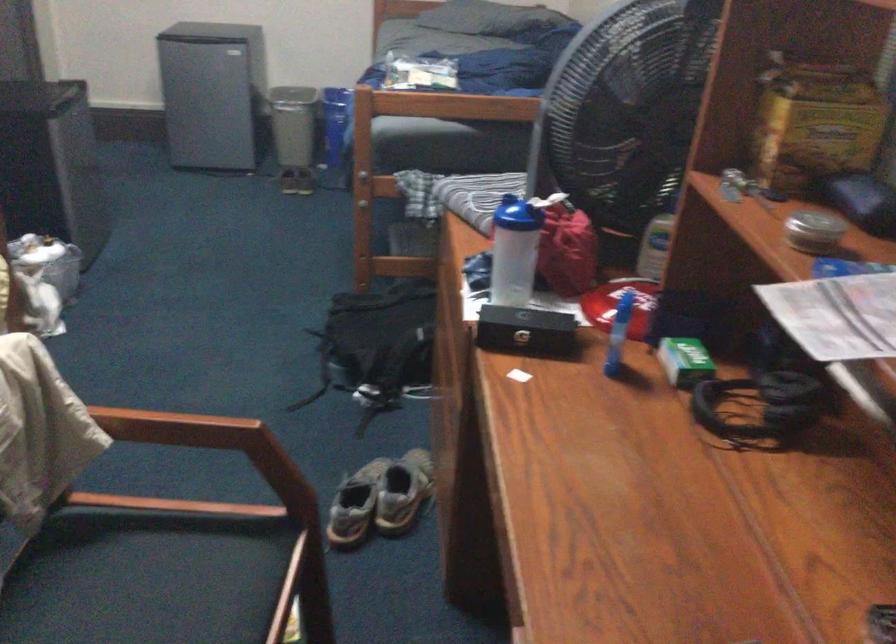
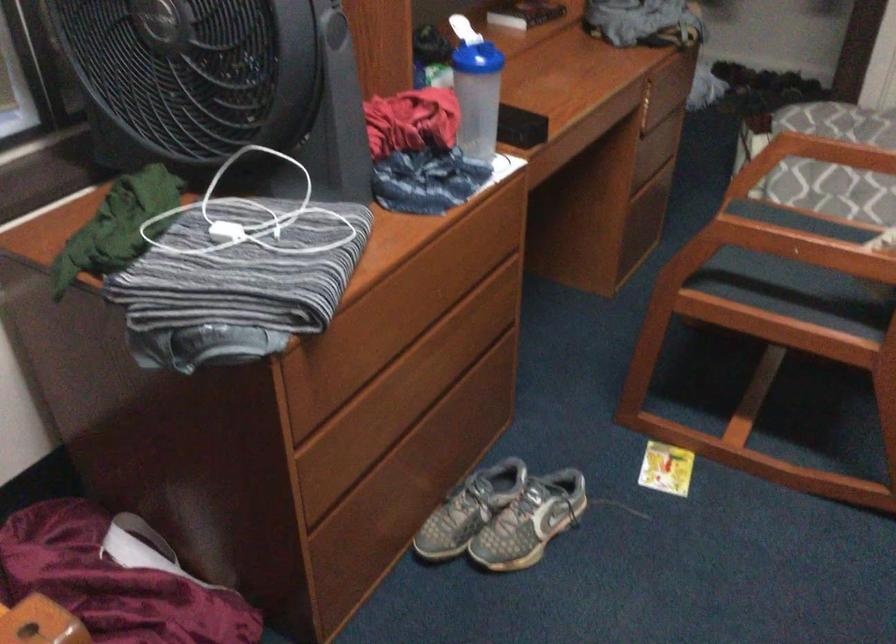
Find the pixel in the second image that matches pixel 444 250 in the first image.

(312, 415)